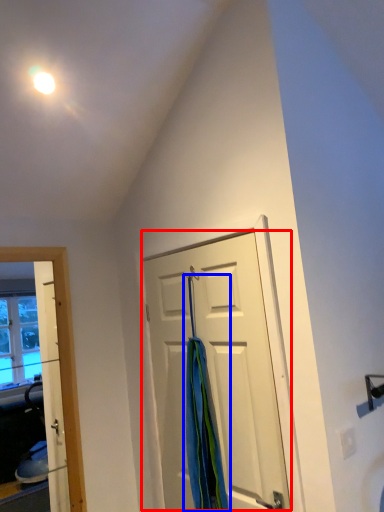
Question: Which of the following is the farthest to the observer, door (highlighted by a red box) or shower curtain (highlighted by a blue box)?

Choices:
 (A) door
 (B) shower curtain

Answer: (B)